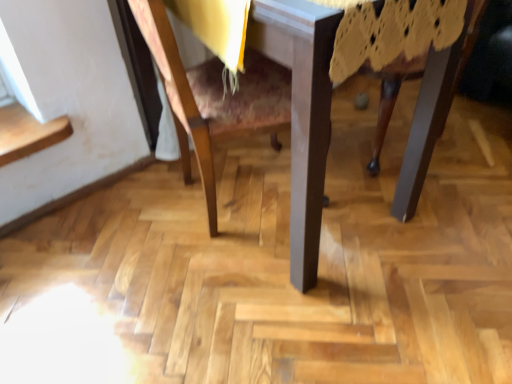
The image size is (512, 384). What are the coordinates of `vacant area that is in front of wooden table at center` in the screenshot? It's located at (282, 314).